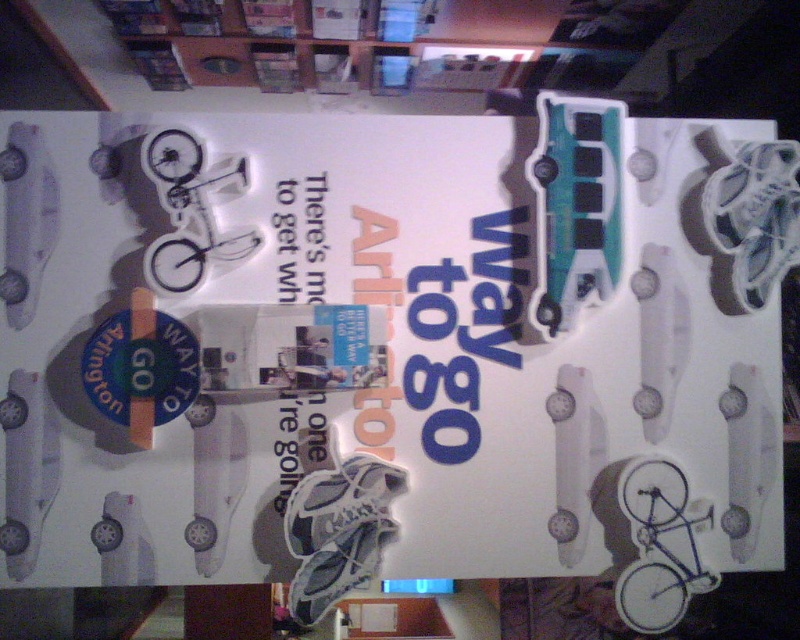
Can you confirm if white paper poster at center is smaller than white paper at center?

No, white paper poster at center is not smaller than white paper at center.

Describe the element at coordinates (388, 337) in the screenshot. This screenshot has height=640, width=800. I see `white paper poster at center` at that location.

The width and height of the screenshot is (800, 640). Identify the location of white paper poster at center. (388, 337).

You are a GUI agent. You are given a task and a screenshot of the screen. Output one action in this format:
    pyautogui.click(x=<x>, y=<y>)
    Task: Click on the white paper poster at center
    Image resolution: width=800 pixels, height=640 pixels.
    Given the screenshot: What is the action you would take?
    pyautogui.click(x=388, y=337)